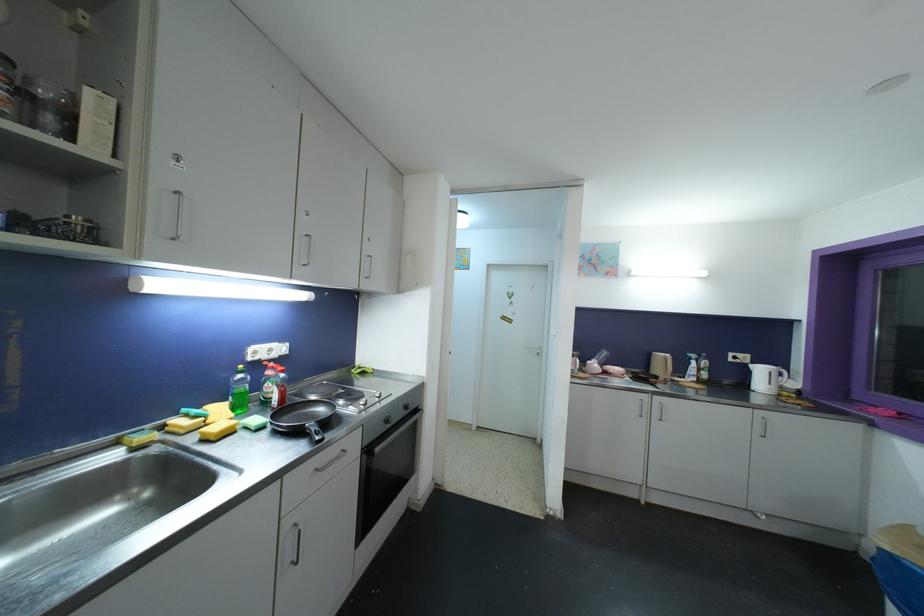
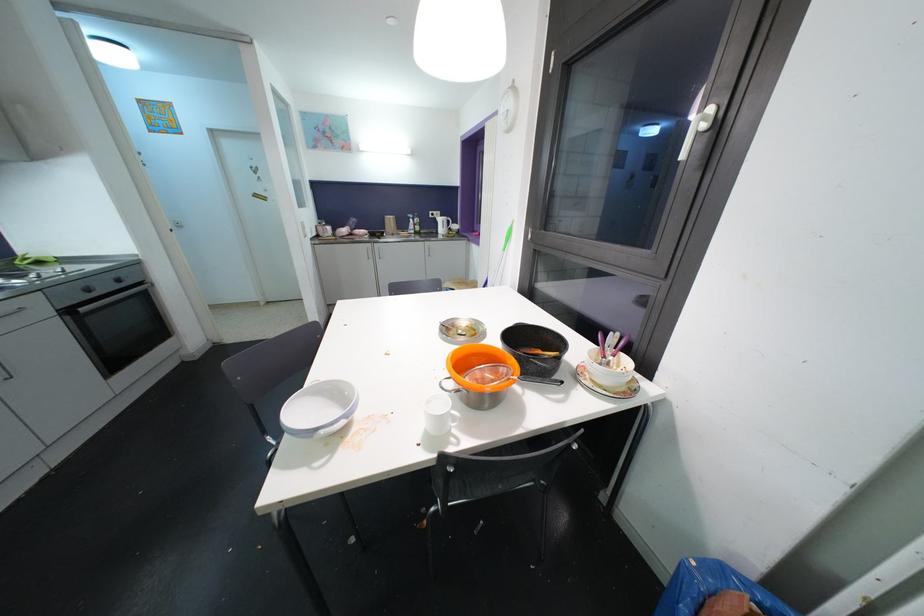
Find the pixel in the second image that matches (x=381, y=453) in the first image.

(84, 312)